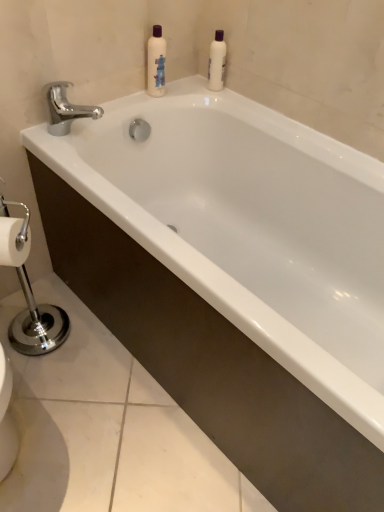
Question: Which direction should I rotate to look at white glossy bottle at upper center, marked as the first cleaning product in a left-to-right arrangement?

Choices:
 (A) left
 (B) right

Answer: (A)

Question: From a real-world perspective, is white plastic bottle at upper center, the 1th cleaning product positioned from the right, located beneath white glossy bottle at upper center, marked as the first cleaning product in a left-to-right arrangement?

Choices:
 (A) yes
 (B) no

Answer: (A)

Question: From a real-world perspective, is white plastic bottle at upper center, the 1th cleaning product positioned from the right, over white glossy bottle at upper center, marked as the second cleaning product in a right-to-left arrangement?

Choices:
 (A) yes
 (B) no

Answer: (B)

Question: Is white glossy bottle at upper center, marked as the first cleaning product in a left-to-right arrangement, inside white plastic bottle at upper center, the 1th cleaning product positioned from the right?

Choices:
 (A) yes
 (B) no

Answer: (B)

Question: Is white plastic bottle at upper center, the 1th cleaning product positioned from the right, closer to the viewer compared to white glossy bottle at upper center, marked as the first cleaning product in a left-to-right arrangement?

Choices:
 (A) no
 (B) yes

Answer: (A)

Question: Is white plastic bottle at upper center, the second cleaning product when ordered from left to right, shorter than white glossy bottle at upper center, marked as the second cleaning product in a right-to-left arrangement?

Choices:
 (A) yes
 (B) no

Answer: (A)

Question: Is white plastic bottle at upper center, the 1th cleaning product positioned from the right, positioned with its back to white glossy bottle at upper center, marked as the second cleaning product in a right-to-left arrangement?

Choices:
 (A) yes
 (B) no

Answer: (B)

Question: Is white glossy bottle at upper center, marked as the first cleaning product in a left-to-right arrangement, located outside chrome/metallic faucet at upper left?

Choices:
 (A) no
 (B) yes

Answer: (B)

Question: Is white glossy bottle at upper center, marked as the first cleaning product in a left-to-right arrangement, aimed at chrome/metallic faucet at upper left?

Choices:
 (A) no
 (B) yes

Answer: (A)

Question: Can you confirm if white glossy bottle at upper center, marked as the first cleaning product in a left-to-right arrangement, is positioned to the right of chrome/metallic faucet at upper left?

Choices:
 (A) no
 (B) yes

Answer: (B)

Question: Could chrome/metallic faucet at upper left be considered to be inside white glossy bottle at upper center, marked as the first cleaning product in a left-to-right arrangement?

Choices:
 (A) yes
 (B) no

Answer: (B)

Question: Is white glossy bottle at upper center, marked as the first cleaning product in a left-to-right arrangement, oriented away from chrome/metallic faucet at upper left?

Choices:
 (A) yes
 (B) no

Answer: (B)

Question: Can you confirm if white glossy bottle at upper center, marked as the second cleaning product in a right-to-left arrangement, is shorter than chrome/metallic faucet at upper left?

Choices:
 (A) yes
 (B) no

Answer: (B)

Question: Considering the relative sizes of chrome/metallic faucet at upper left and white glossy bottle at upper center, marked as the second cleaning product in a right-to-left arrangement, in the image provided, is chrome/metallic faucet at upper left smaller than white glossy bottle at upper center, marked as the second cleaning product in a right-to-left arrangement,?

Choices:
 (A) yes
 (B) no

Answer: (B)